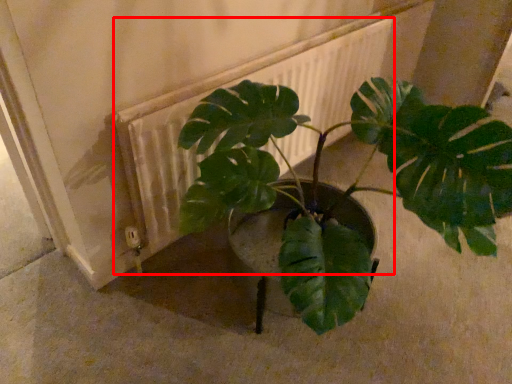
Question: From the image's perspective, considering the relative positions of radiator (annotated by the red box) and houseplant in the image provided, where is radiator (annotated by the red box) located with respect to the staircase?

Choices:
 (A) above
 (B) below

Answer: (A)